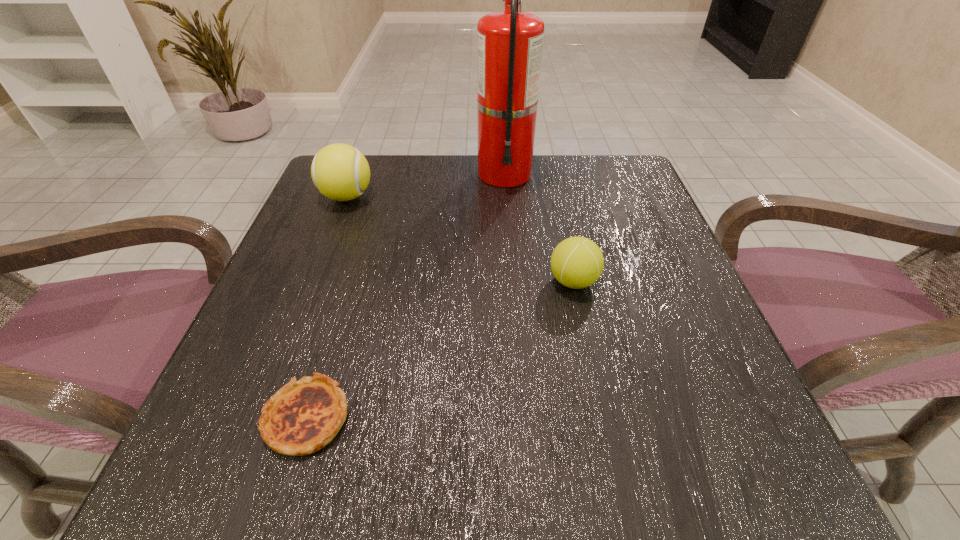
This screenshot has height=540, width=960. What are the coordinates of `free space located on the right of the nearest object` in the screenshot? It's located at (460, 417).

Identify the location of fire extinguisher that is positioned at the far edge. (509, 43).

Find the location of a particular element. tennis ball that is at the far edge is located at coordinates (340, 172).

Where is `object at the near edge`? The image size is (960, 540). object at the near edge is located at coordinates (303, 416).

Find the location of `tennis ball that is at the left edge`. tennis ball that is at the left edge is located at coordinates (340, 172).

Locate an element on the screen. The height and width of the screenshot is (540, 960). quiche that is at the left edge is located at coordinates (303, 416).

At what (x,y) coordinates should I click in order to perform the action: click on object positioned at the right edge. Please return your answer as a coordinate pair (x, y). Looking at the image, I should click on (577, 262).

This screenshot has width=960, height=540. I want to click on object present at the far left corner, so click(x=340, y=172).

Locate an element on the screen. object located in the near left corner section of the desktop is located at coordinates (303, 416).

Where is `vacant space at the far edge`? This screenshot has width=960, height=540. vacant space at the far edge is located at coordinates (393, 180).